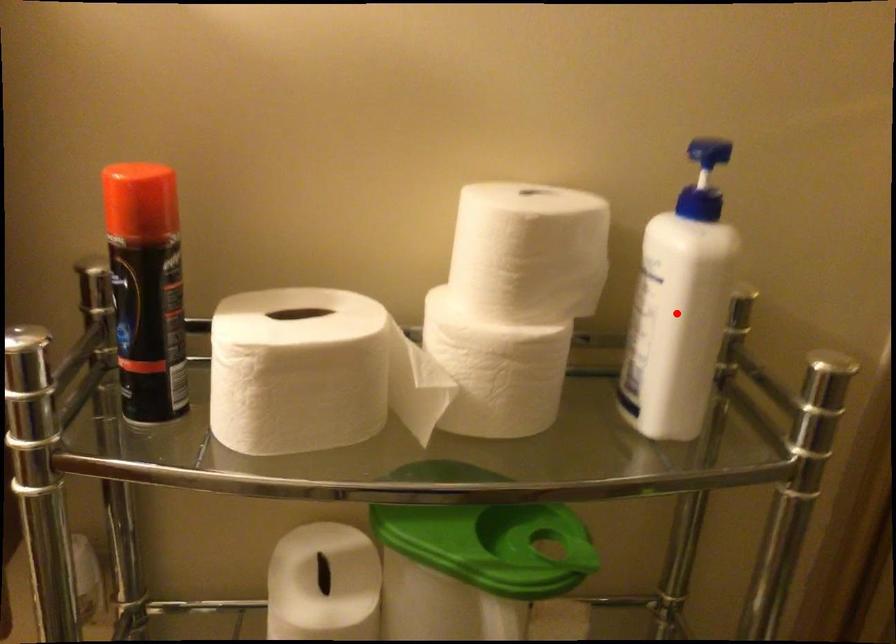
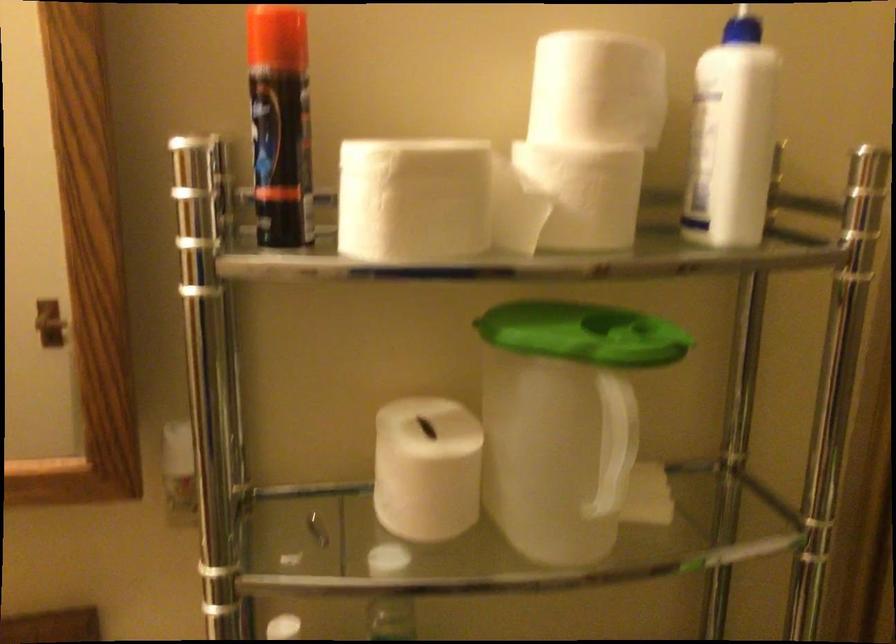
The point at the highlighted location is marked in the first image. Where is the corresponding point in the second image?

(731, 137)